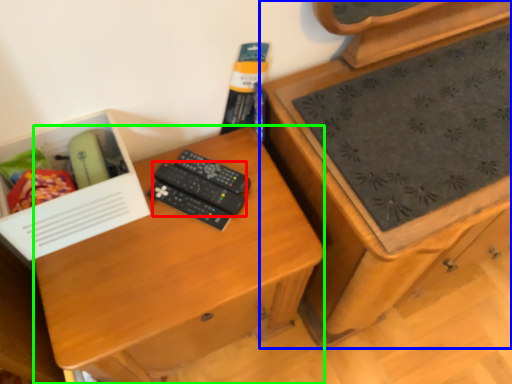
Question: Which is farther away from remote control (highlighted by a red box)? chest of drawers (highlighted by a blue box) or desk (highlighted by a green box)?

Choices:
 (A) chest of drawers
 (B) desk

Answer: (A)